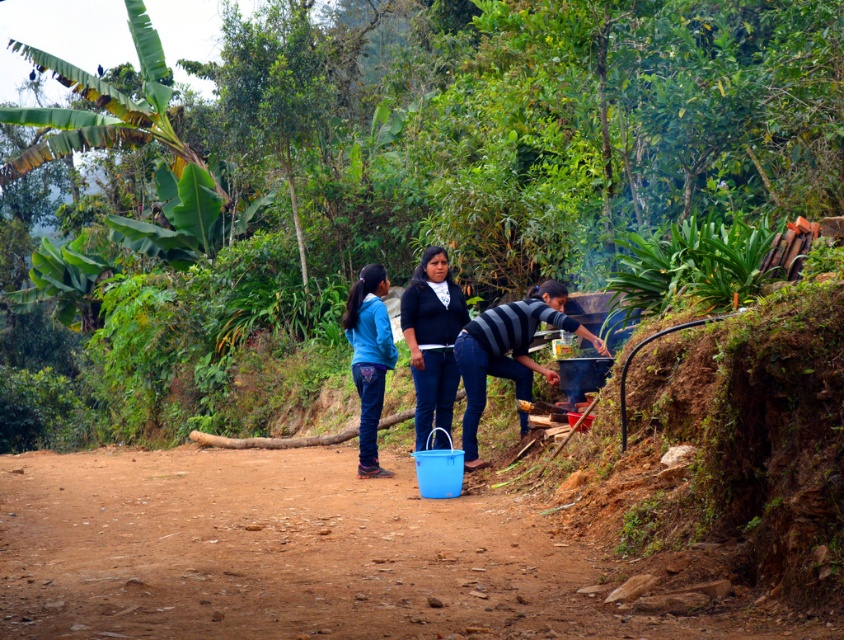
Question: Which object appears farthest from the camera in this image?

Choices:
 (A) blue fabric pants at center
 (B) matte black sweater at center
 (C) brown dirt track at center

Answer: (A)

Question: Which point is farther to the camera?

Choices:
 (A) (472, 372)
 (B) (482, 561)
 (C) (437, 307)
 (D) (361, 307)

Answer: (D)

Question: Is brown dirt track at center closer to the viewer compared to matte black sweater at center?

Choices:
 (A) no
 (B) yes

Answer: (B)

Question: Is striped fabric person at right above blue fabric pants at center?

Choices:
 (A) no
 (B) yes

Answer: (A)

Question: Which point appears farthest from the camera in this image?

Choices:
 (A) (63, 470)
 (B) (526, 385)
 (C) (388, 356)
 (D) (422, 385)

Answer: (A)

Question: Does brown dirt track at center have a greater width compared to matte black sweater at center?

Choices:
 (A) no
 (B) yes

Answer: (B)